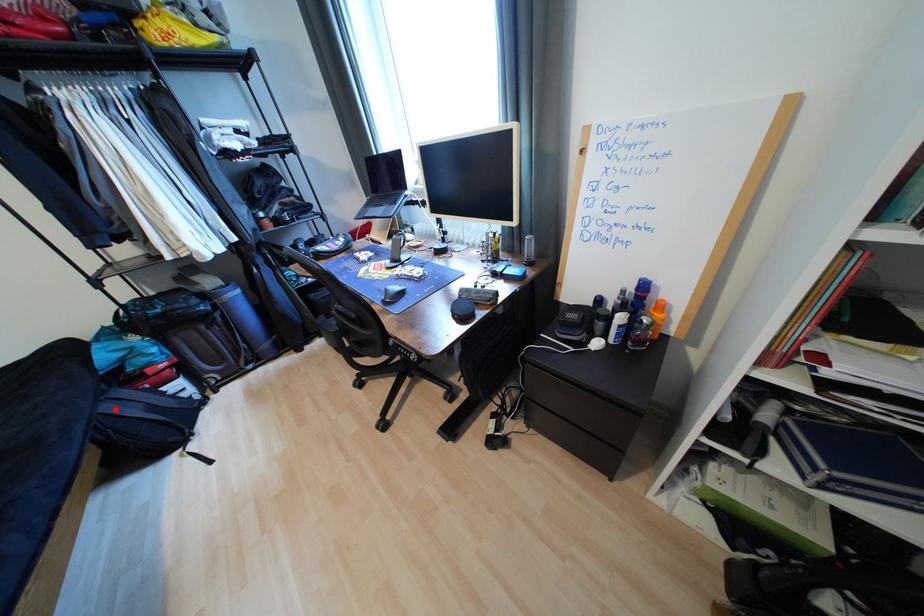
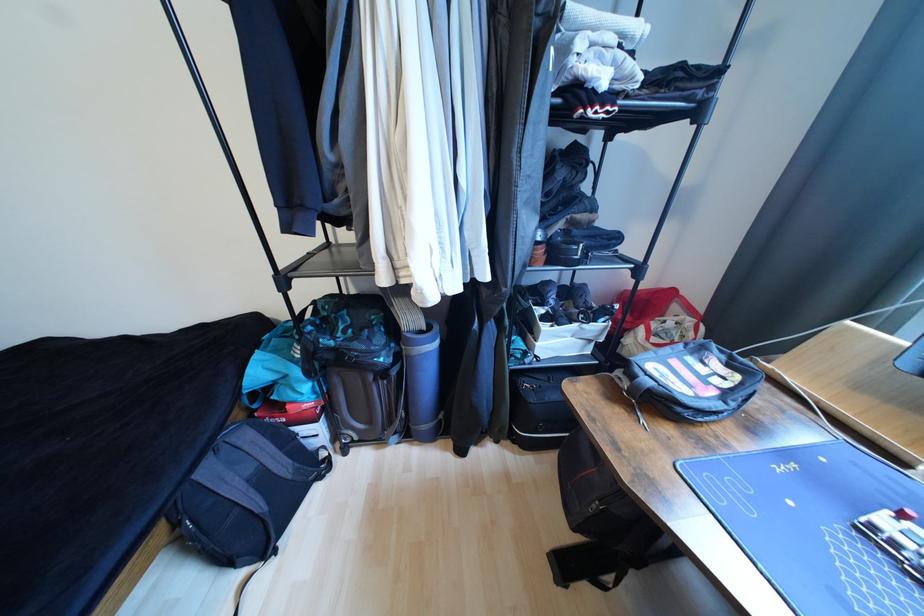
Locate, in the second image, the point that corresponds to the highlighted location in the first image.

(215, 472)